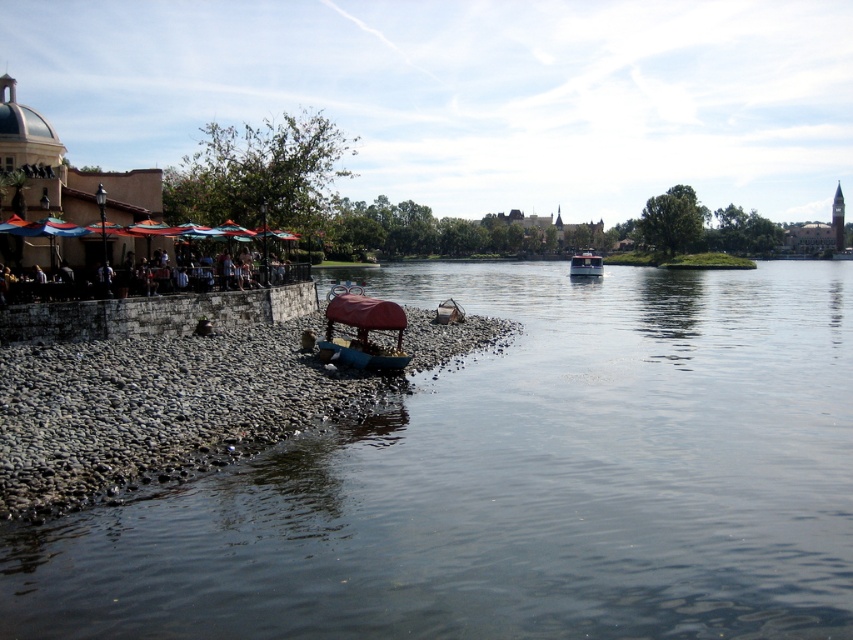
Question: Which point is closer to the camera?

Choices:
 (A) (193, 276)
 (B) (670, 582)

Answer: (B)

Question: Does blue plastic boat at lower left appear on the right side of metallic red boat at center?

Choices:
 (A) yes
 (B) no

Answer: (B)

Question: Is smooth stone river at lower left bigger than metallic red boat at center?

Choices:
 (A) yes
 (B) no

Answer: (B)

Question: Which object appears closest to the camera in this image?

Choices:
 (A) metallic red boat at center
 (B) smooth stone river at lower left

Answer: (B)

Question: Which of the following is the closest to the observer?

Choices:
 (A) (155, 362)
 (B) (358, 326)
 (C) (584, 256)

Answer: (A)

Question: Considering the relative positions of smooth stone river at lower left and metallic red boat at center in the image provided, where is smooth stone river at lower left located with respect to metallic red boat at center?

Choices:
 (A) right
 (B) left

Answer: (B)